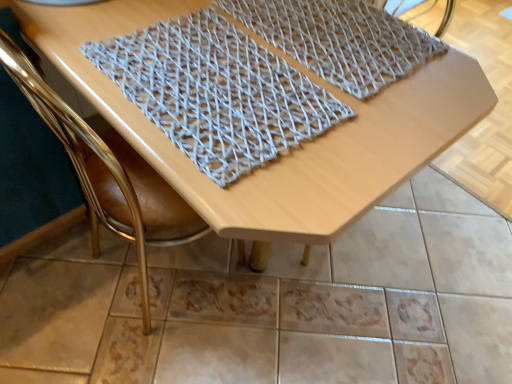
This screenshot has width=512, height=384. I want to click on free spot in front of gray woven mat at upper center, acting as the 1th blanket starting from the right, so click(350, 143).